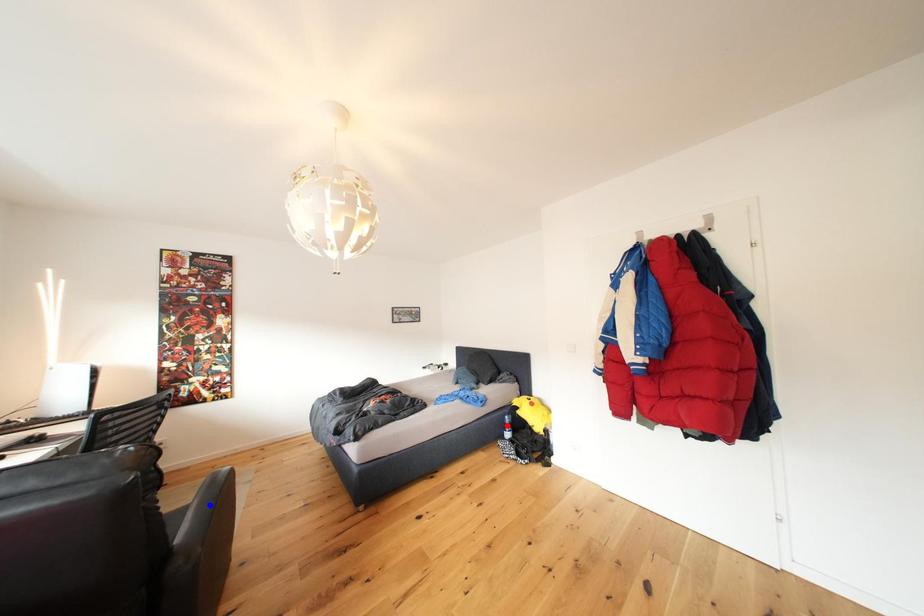
Question: Which of the two points in the image is closer to the camera?

Choices:
 (A) Blue point is closer.
 (B) Red point is closer.

Answer: (A)